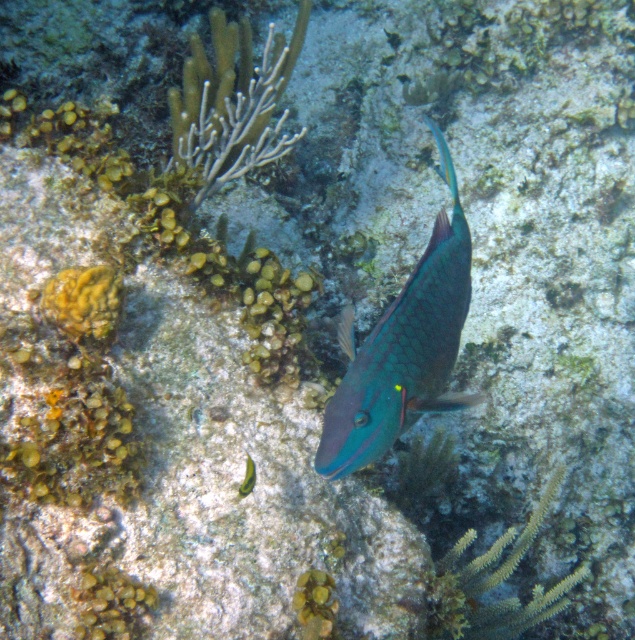
You are a marine biologist observing an underwater scene with a shiny teal fish at center and a green matte fish at center. Which fish is positioned to the right of the other?

The shiny teal fish at center is to the right of the green matte fish at center.

You are a marine biologist observing an underwater scene. You notice a point at coordinates (403, 349). Which object in the scene is this point located on?

The point at coordinates (403, 349) is located on the shiny teal fish at center.